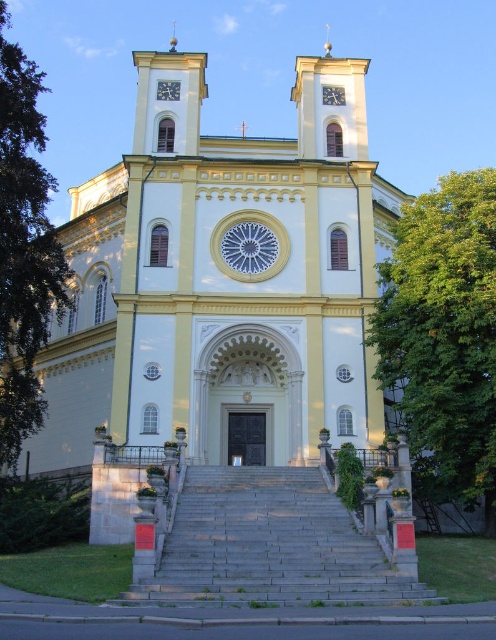
You are standing at point A, which is located at coordinates (222, 282). What can you see directly in front of you?

You can see the yellow stone church at center directly in front of you at point A.

You are standing in front of the grand church and want to reach the point marked at coordinates point (379, 374). If your maximum reach is 50 meters, can you reach it?

The point (379, 374) is 53.18 meters away from the camera, so you cannot reach it with a maximum reach of 50 meters.